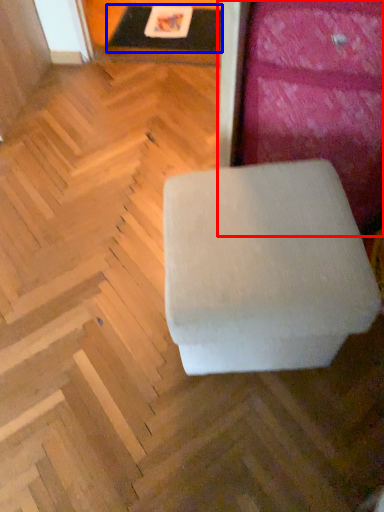
Question: Among these objects, which one is farthest to the camera, furniture (highlighted by a red box) or table (highlighted by a blue box)?

Choices:
 (A) furniture
 (B) table

Answer: (B)